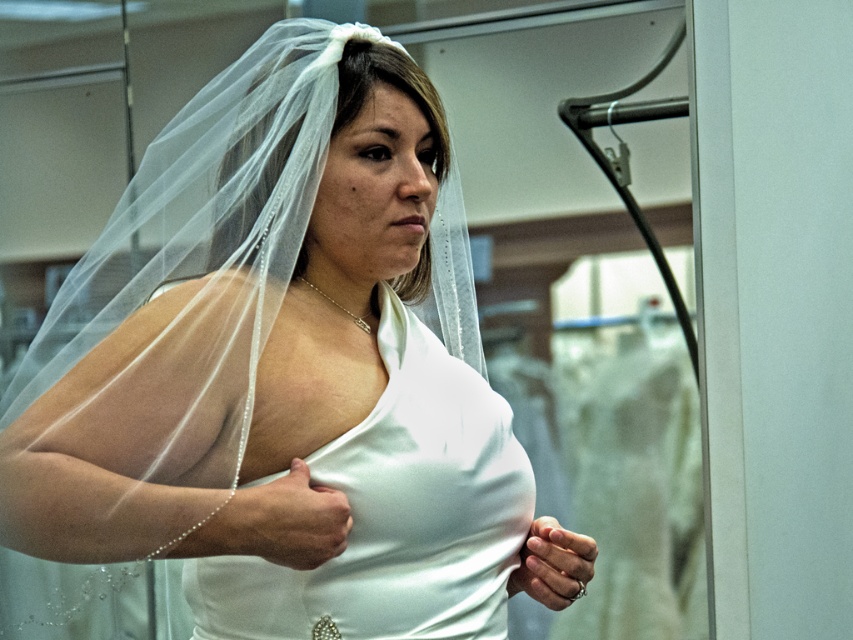
Question: Is white satin dress at center closer to the viewer compared to white satin gown at center?

Choices:
 (A) no
 (B) yes

Answer: (B)

Question: Can you confirm if white satin dress at center is positioned to the left of white satin gown at center?

Choices:
 (A) yes
 (B) no

Answer: (A)

Question: Considering the relative positions of white satin dress at center and white satin gown at center in the image provided, where is white satin dress at center located with respect to white satin gown at center?

Choices:
 (A) below
 (B) above

Answer: (B)

Question: Which of the following is the closest to the observer?

Choices:
 (A) (346, 580)
 (B) (422, 452)

Answer: (A)

Question: Which object is farther from the camera taking this photo?

Choices:
 (A) white satin dress at center
 (B) white satin gown at center

Answer: (B)